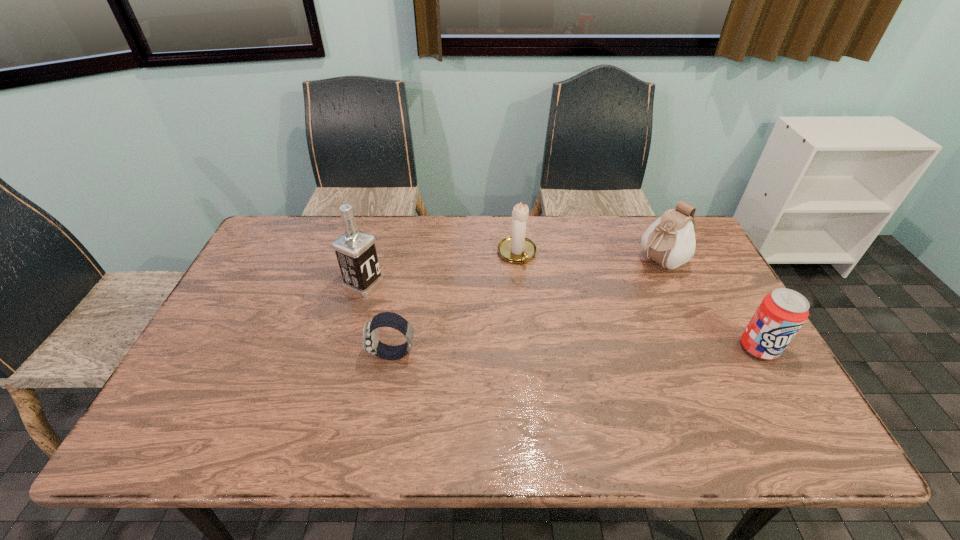
Choose which object is the nearest neighbor to the pouch. Please provide its 2D coordinates. Your answer should be formatted as a tuple, i.e. [(x, y)], where the tuple contains the x and y coordinates of a point satisfying the conditions above.

[(781, 314)]

Where is `vacant region that satisfies the following two spatial constraints: 1. on the back side of the leftmost object; 2. on the right side of the third object from left to right`? The height and width of the screenshot is (540, 960). vacant region that satisfies the following two spatial constraints: 1. on the back side of the leftmost object; 2. on the right side of the third object from left to right is located at coordinates (372, 254).

Find the location of a particular element. free spot that satisfies the following two spatial constraints: 1. on the back side of the third object from left to right; 2. on the left side of the tallest object is located at coordinates (372, 254).

Locate an element on the screen. The width and height of the screenshot is (960, 540). free location that satisfies the following two spatial constraints: 1. on the back side of the fourth object from left to right; 2. on the right side of the leftmost object is located at coordinates (370, 262).